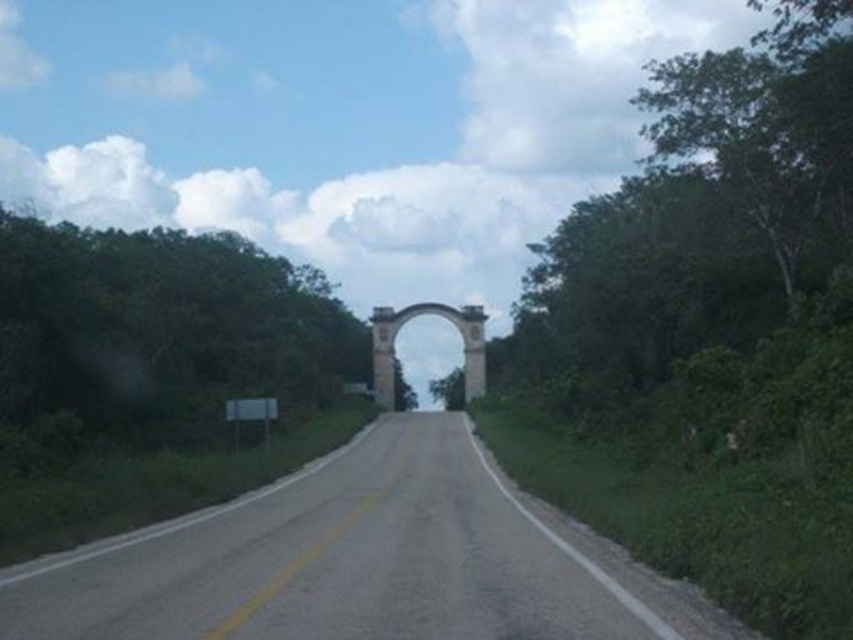
You are a driver approaching the white stone archway at center while driving on the asphalt road at center. Can your car, which is 2 meters wide, safely pass through the archway without touching its sides?

The asphalt road at center has a lesser width compared to the white stone archway at center. Since the road is narrower than the archway, the car can safely pass through as the road itself is within the archway.

You are driving a car that is 2 meters wide and want to pass under the white stone archway at center while staying on the asphalt road at center. Is there enough space for your car to pass through without touching the archway?

The asphalt road at center is positioned on the right side of the white stone archway at center, so the car can safely pass through the archway as the road is aligned under it. However, the description does not provide specific measurements about the width of the archway or the clearance height, so we cannot confirm if the 2 meter wide car will fit laterally or vertically. Further information is needed to ensure safe passage.